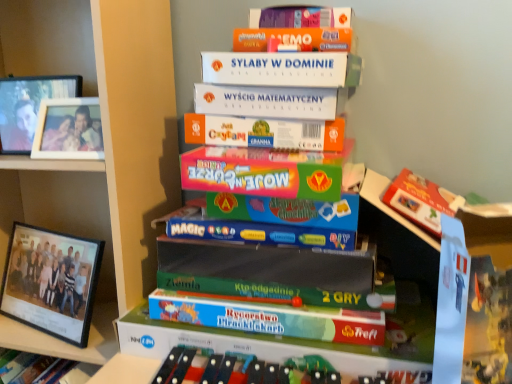
Question: From their relative heights in the image, would you say green matte board game at center, arranged as the 1th book when viewed from the top, is taller or shorter than matte plastic game at center, the 1th book positioned from the bottom?

Choices:
 (A) short
 (B) tall

Answer: (B)

Question: Is green matte board game at center, arranged as the 1th book when viewed from the top, spatially inside matte plastic game at center, which is the 2th book from top to bottom, or outside of it?

Choices:
 (A) outside
 (B) inside

Answer: (A)

Question: Which object is positioned farthest from the matte plastic game at center, the 1th book positioned from the bottom?

Choices:
 (A) wooden photo frame at left, positioned as the second picture frame in bottom-to-top order
 (B) white cardboard boxes at center
 (C) wooden photo frame at left, the 1th picture frame viewed from the top
 (D) green matte board game at center, acting as the 2th book starting from the bottom
 (E) black plastic picture frame at left, which ranks as the 3th picture frame in top-to-bottom order

Answer: (C)

Question: Which is nearer to the green matte board game at center, arranged as the 1th book when viewed from the top?

Choices:
 (A) black plastic picture frame at left, the 1th picture frame ordered from the bottom
 (B) wooden photo frame at left, the 1th picture frame viewed from the top
 (C) white cardboard boxes at center
 (D) wooden photo frame at left, positioned as the second picture frame in bottom-to-top order
 (E) matte plastic game at center, the 1th book positioned from the bottom

Answer: (E)